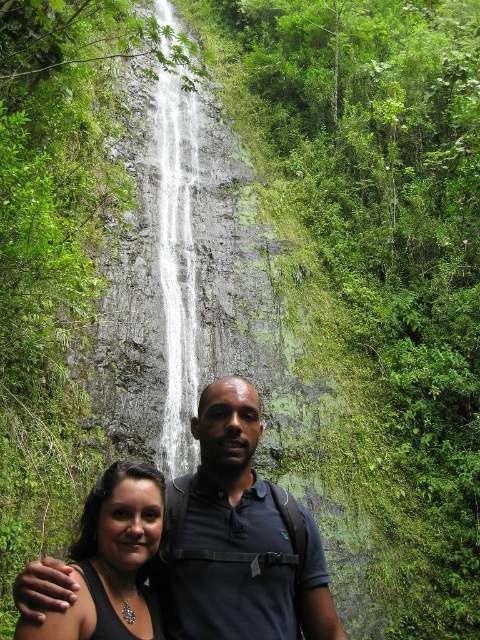
Question: Which point is farther to the camera?

Choices:
 (A) (288, 518)
 (B) (90, 609)

Answer: (A)

Question: Which of these objects is positioned closest to the dark blue shirt at center?

Choices:
 (A) shiny silver necklace at lower left
 (B) gray stone waterfall at center

Answer: (A)

Question: Does dark blue shirt at center appear over gray stone waterfall at center?

Choices:
 (A) no
 (B) yes

Answer: (A)

Question: Does dark blue shirt at center have a larger size compared to shiny silver necklace at lower left?

Choices:
 (A) yes
 (B) no

Answer: (A)

Question: Among these points, which one is farthest from the camera?

Choices:
 (A) (276, 600)
 (B) (127, 483)
 (C) (187, 420)

Answer: (C)

Question: Does dark blue shirt at center have a lesser width compared to gray stone waterfall at center?

Choices:
 (A) yes
 (B) no

Answer: (A)